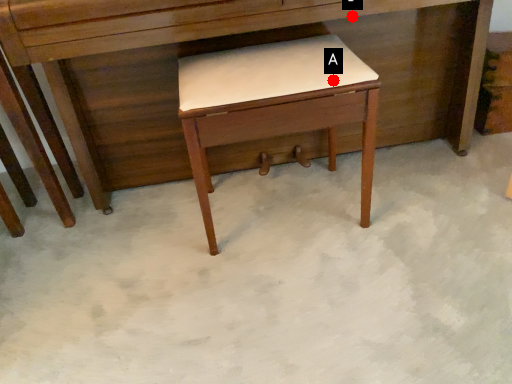
Question: Two points are circled on the image, labeled by A and B beside each circle. Which point is further to the camera?

Choices:
 (A) A is further
 (B) B is further

Answer: (B)